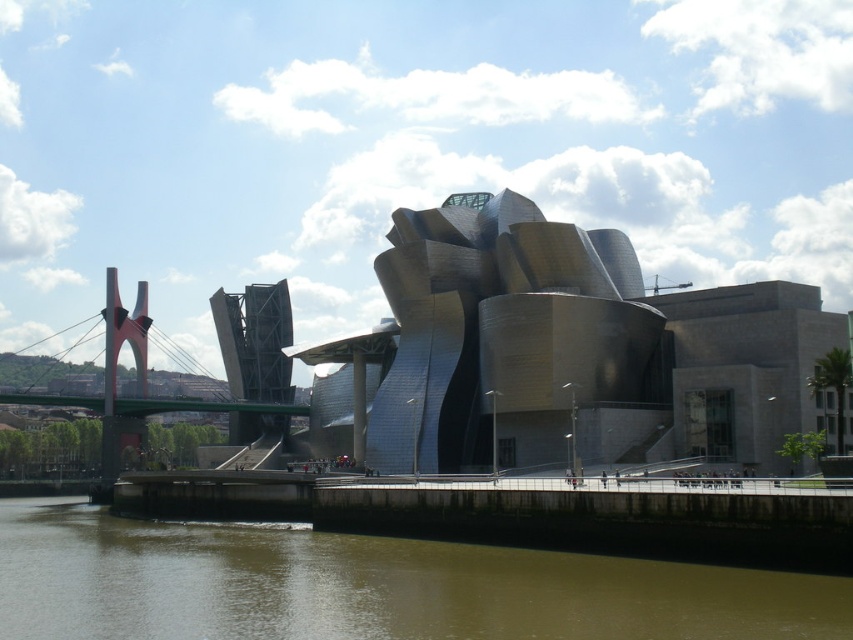
You are standing in front of the Guggenheim Museum Bilbao and notice two points marked on the ground. The first point is at coordinates point (268, 625), and the second point is at point (281, 321). Which point is closer to you?

Point (268, 625) is closer to the camera than point (281, 321), so the first point is closer to you.

You are standing at the coordinates point 0.552, 0.662 in the Guggenheim Museum Bilbao scene. Which object from the list below is located exactly at your current position? Please choose from the following options. metallic silver building at center

The metallic silver building at center is located exactly at point (564,353), so that is the object at your current position.